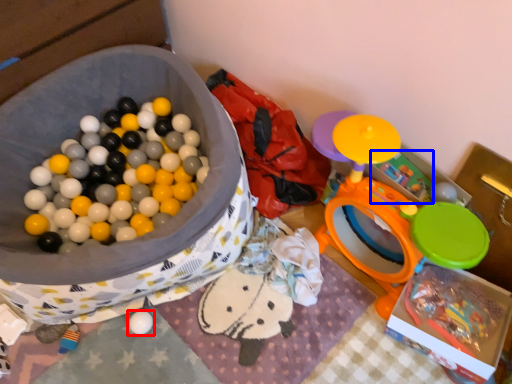
Question: Which object appears closest to the camera in this image, toy (highlighted by a red box) or toy (highlighted by a blue box)?

Choices:
 (A) toy
 (B) toy

Answer: (B)